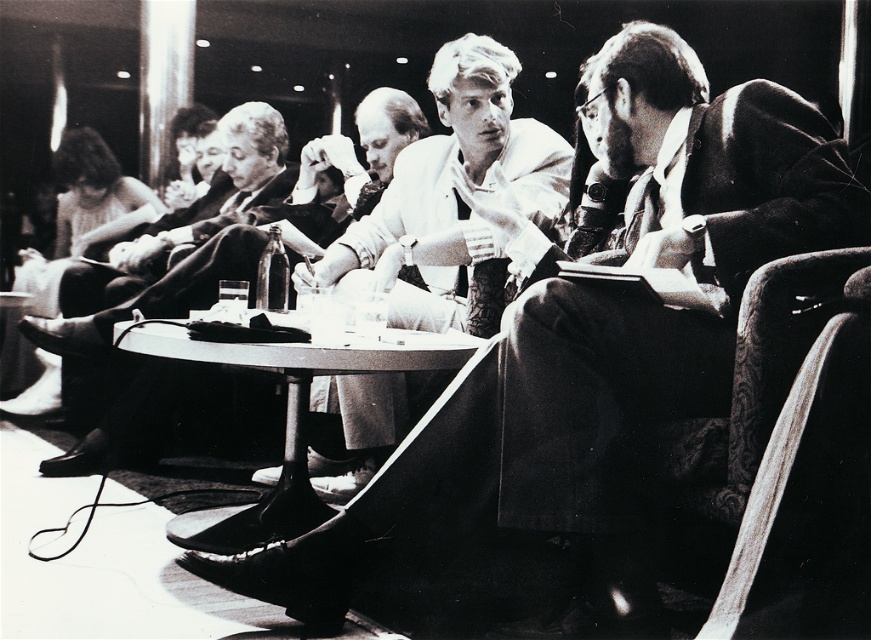
You are standing in the room and see the point at coordinate (453, 200). What object is located at that point?

The point at coordinate (453, 200) is located on the white cotton shirt at center.

You are arranging a meeting in this room and need to place a name tag on the smooth plastic table at center. To ensure it doesn not block the smooth leather jacket at center, where should you place the name tag?

The smooth leather jacket at center is to the left of the smooth plastic table at center, so placing the name tag to the right side of the smooth plastic table at center will ensure it does not block the jacket.

You are a photographer trying to capture a closeup of the smooth leather jacket at center and the smooth plastic table at center in the image. Since you can only focus on one object clearly, which object should you choose to ensure it takes up more of the frame?

The smooth leather jacket at center has a larger size compared to the smooth plastic table at center, so you should focus on the smooth leather jacket at center to ensure it takes up more of the frame.